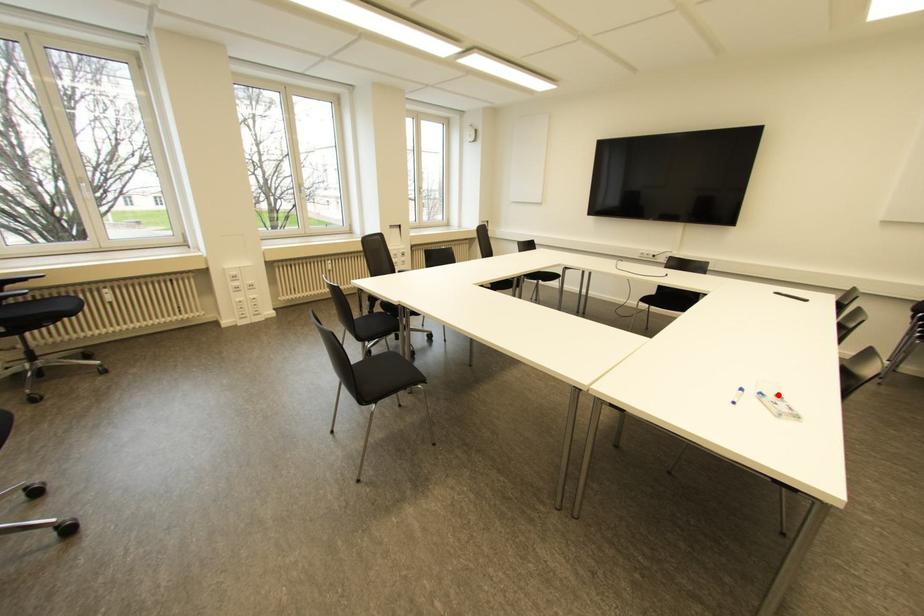
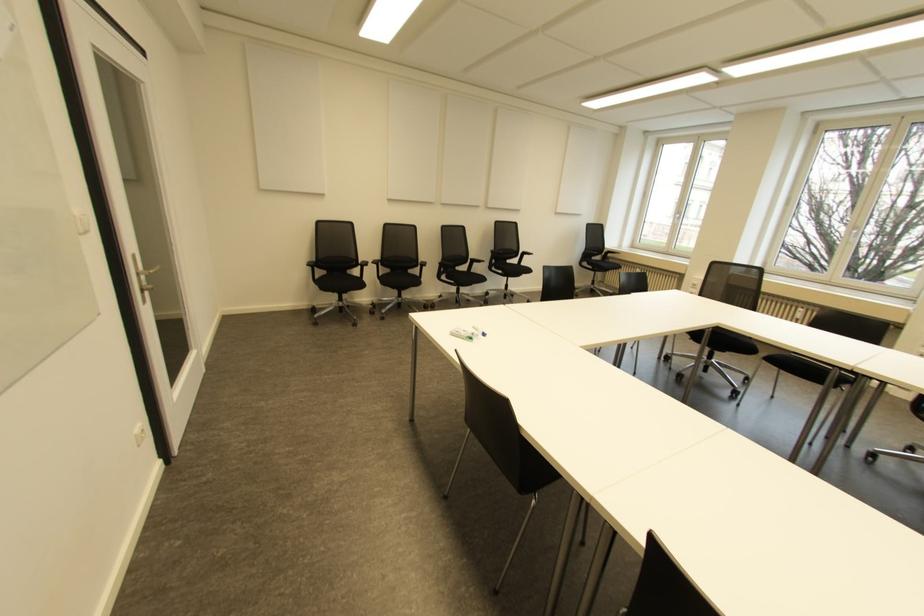
Where in the second image is the point corresponding to the highlighted location from the first image?

(470, 338)